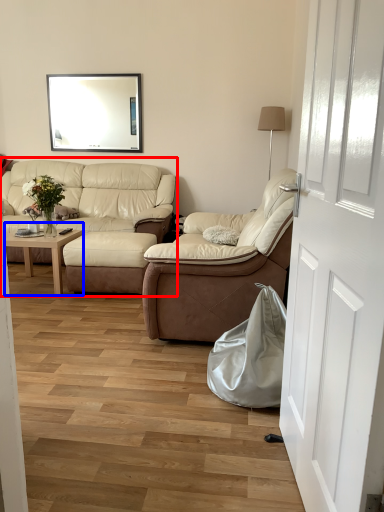
Question: Which object is closer to the camera taking this photo, studio couch (highlighted by a red box) or coffee table (highlighted by a blue box)?

Choices:
 (A) studio couch
 (B) coffee table

Answer: (B)